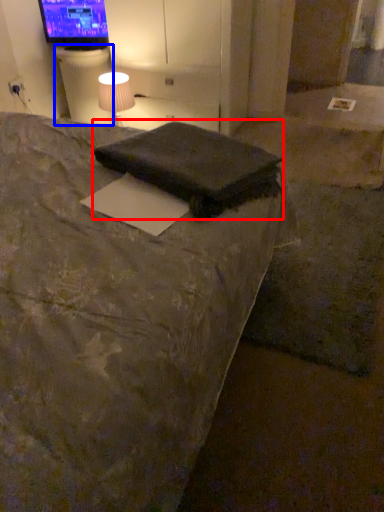
Question: Which object appears closest to the camera in this image, pillow (highlighted by a red box) or table (highlighted by a blue box)?

Choices:
 (A) pillow
 (B) table

Answer: (A)